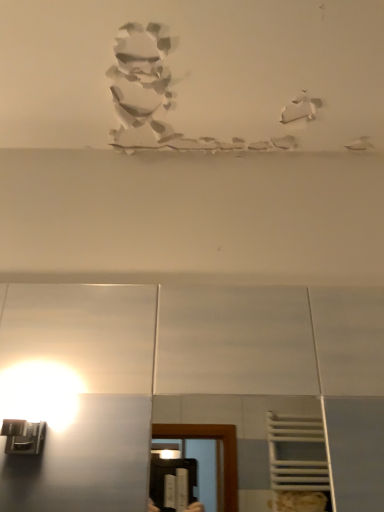
Measure the distance between matte white light fixture at lower left and camera.

31.81 inches.

Locate an element on the screen. matte white light fixture at lower left is located at coordinates (39, 393).

This screenshot has width=384, height=512. What do you see at coordinates (39, 393) in the screenshot?
I see `matte white light fixture at lower left` at bounding box center [39, 393].

This screenshot has height=512, width=384. Identify the location of matte white light fixture at lower left. pyautogui.click(x=39, y=393).